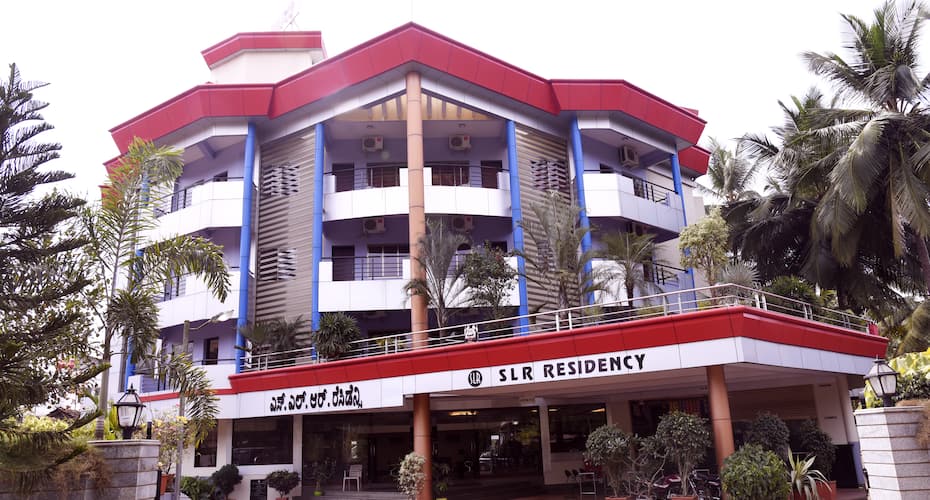
Locate an element on the screen. chair is located at coordinates (350, 481).